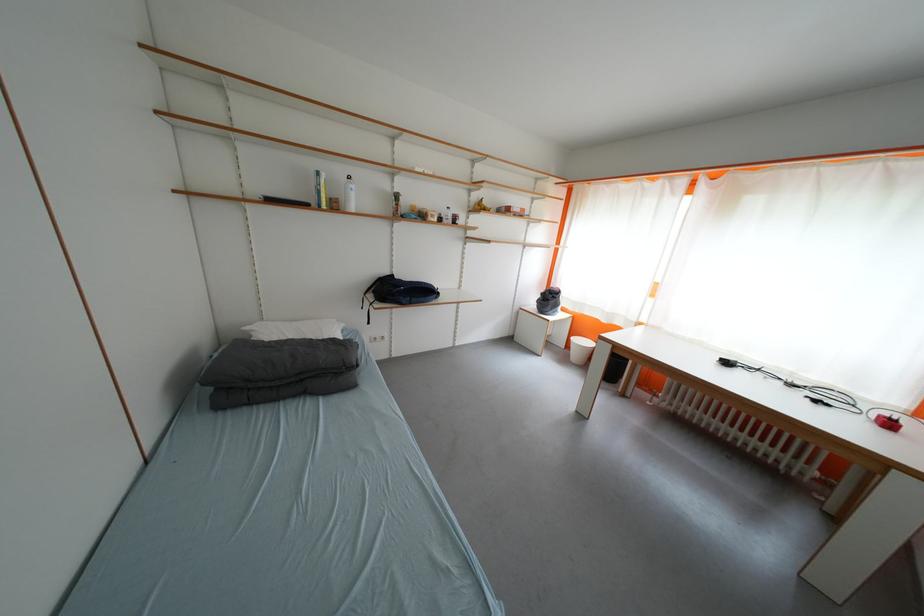
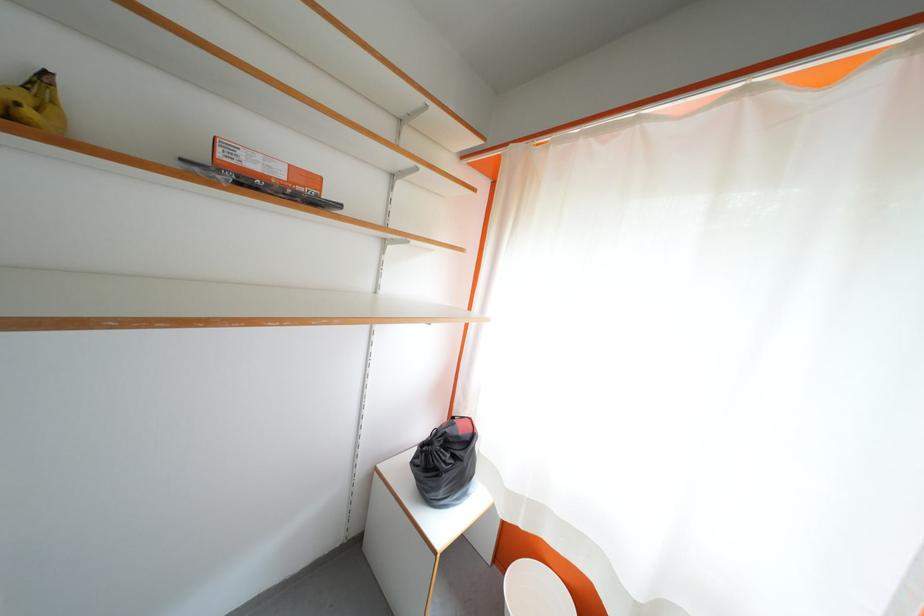
Which direction would the cameraman need to move to produce the second image?

The movement direction of the cameraman is right, forward.